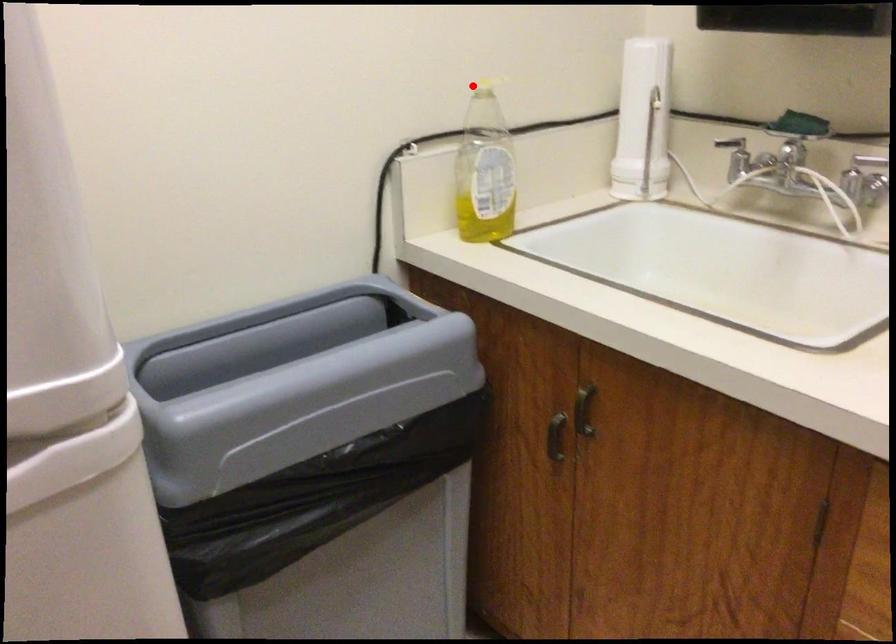
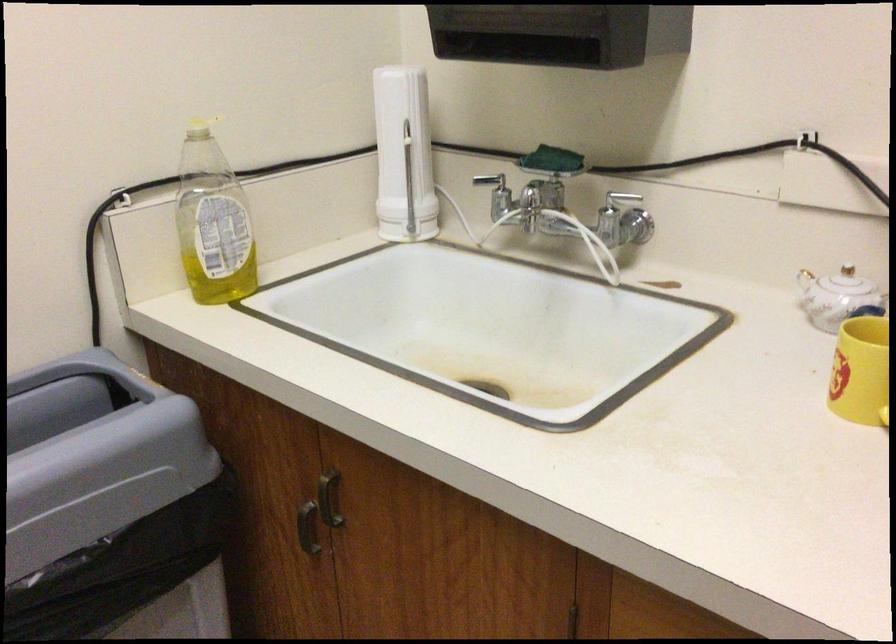
Find the pixel in the second image that matches the highlighted location in the first image.

(200, 128)